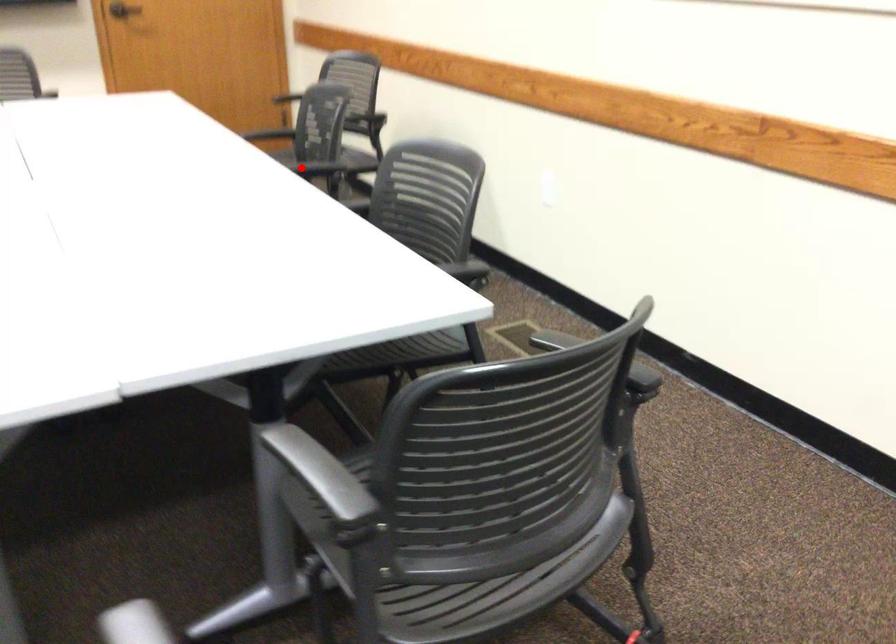
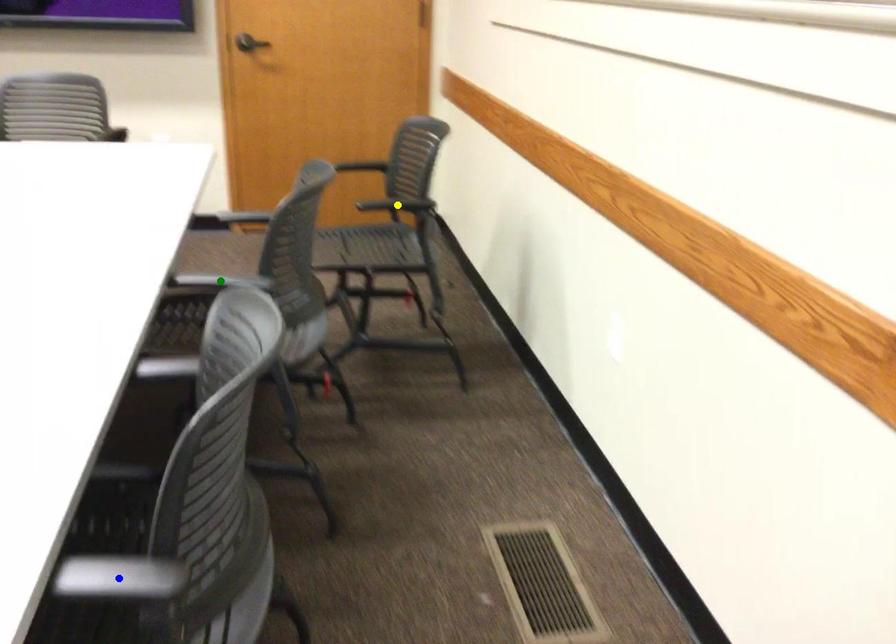
Question: I am providing you with two images of the same scene from different viewpoints. A red point is marked on the first image. You are given multiple points on the second image. Which point in image 2 represents the same 3d spot as the red point in image 1?

Choices:
 (A) yellow point
 (B) green point
 (C) blue point

Answer: (B)